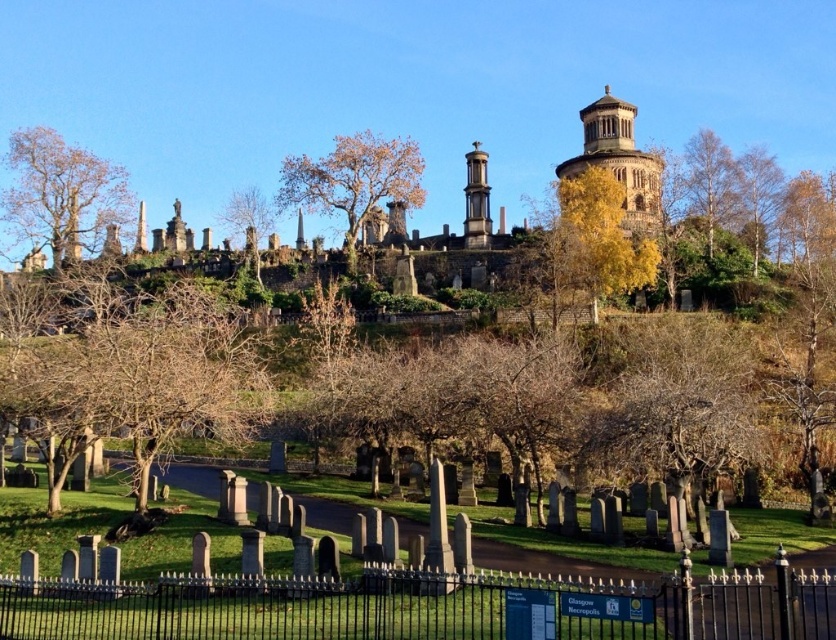
Question: Which point appears closest to the camera in this image?

Choices:
 (A) (487, 154)
 (B) (658, 198)

Answer: (A)

Question: Which object appears farthest from the camera in this image?

Choices:
 (A) black wrought iron fence at lower center
 (B) smooth stone tower at center
 (C) bare wood tree at upper left

Answer: (C)

Question: Does stone castle at upper center have a greater width compared to brown stone tower at upper center?

Choices:
 (A) yes
 (B) no

Answer: (A)

Question: Does bare wood tree at upper left appear under brown stone tower at upper center?

Choices:
 (A) no
 (B) yes

Answer: (B)

Question: Which of these objects is positioned farthest from the brown textured tree at center?

Choices:
 (A) stone castle at upper center
 (B) smooth stone tower at center
 (C) bare wood tree at upper left
 (D) brown leafy tree at center

Answer: (A)

Question: Does stone castle at upper center come in front of brown leafy tree at center?

Choices:
 (A) no
 (B) yes

Answer: (B)